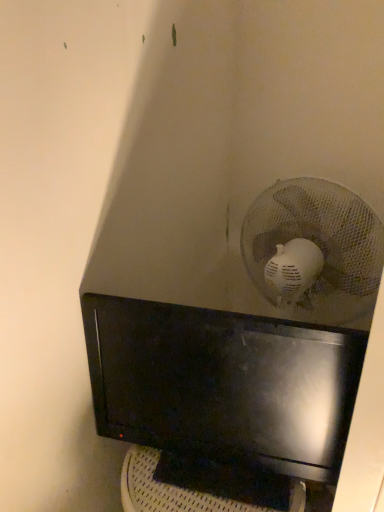
Locate an element on the screen. The image size is (384, 512). black glossy computer monitor at center is located at coordinates (224, 385).

The height and width of the screenshot is (512, 384). What do you see at coordinates (224, 385) in the screenshot? I see `black glossy computer monitor at center` at bounding box center [224, 385].

Measure the distance between black glossy computer monitor at center and camera.

71.05 centimeters.

This screenshot has height=512, width=384. In order to click on black glossy computer monitor at center in this screenshot , I will do `click(224, 385)`.